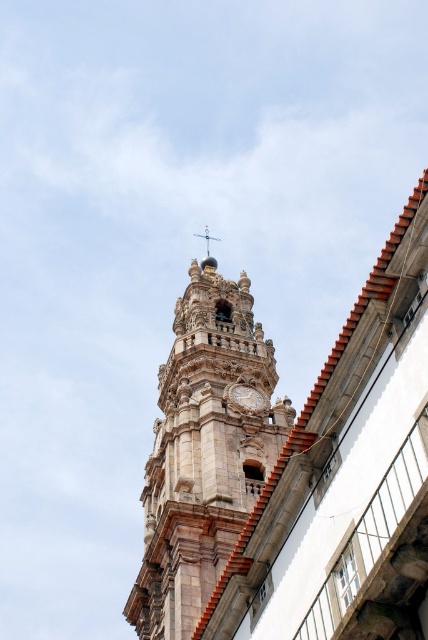
Question: Which point is closer to the camera taking this photo?

Choices:
 (A) (250, 410)
 (B) (213, 259)

Answer: (A)

Question: Among these objects, which one is nearest to the camera?

Choices:
 (A) white stone clock at upper center
 (B) stone clock tower at center
 (C) gold textured dome at upper center

Answer: (B)

Question: Can you confirm if stone clock tower at center is wider than gold textured dome at upper center?

Choices:
 (A) no
 (B) yes

Answer: (B)

Question: Where is stone clock tower at center located in relation to gold textured dome at upper center in the image?

Choices:
 (A) right
 (B) left

Answer: (B)

Question: In this image, where is white stone clock at upper center located relative to gold textured dome at upper center?

Choices:
 (A) below
 (B) above

Answer: (A)

Question: Which is farther from the stone clock tower at center?

Choices:
 (A) white stone clock at upper center
 (B) gold textured dome at upper center

Answer: (B)